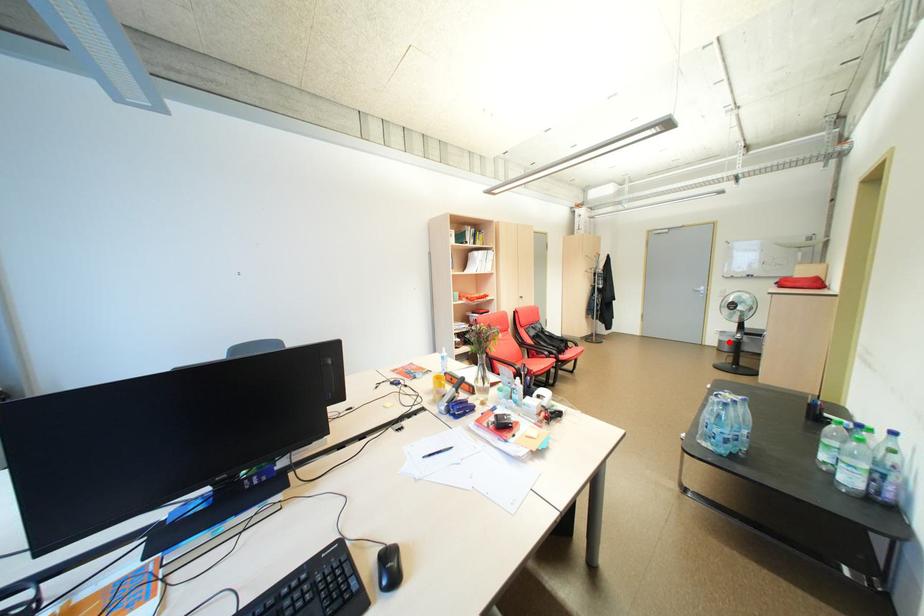
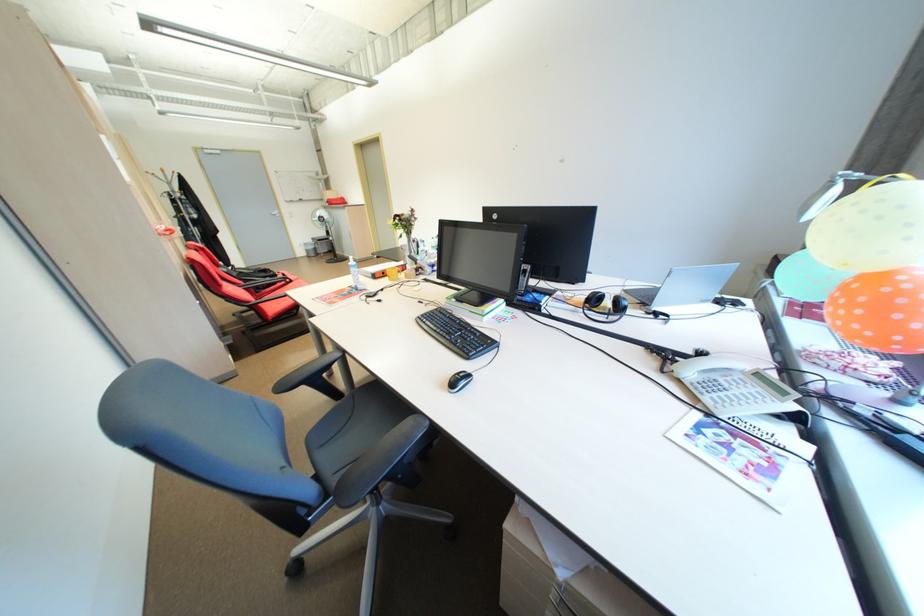
Find the pixel in the second image that matches the highlighted location in the first image.

(315, 252)